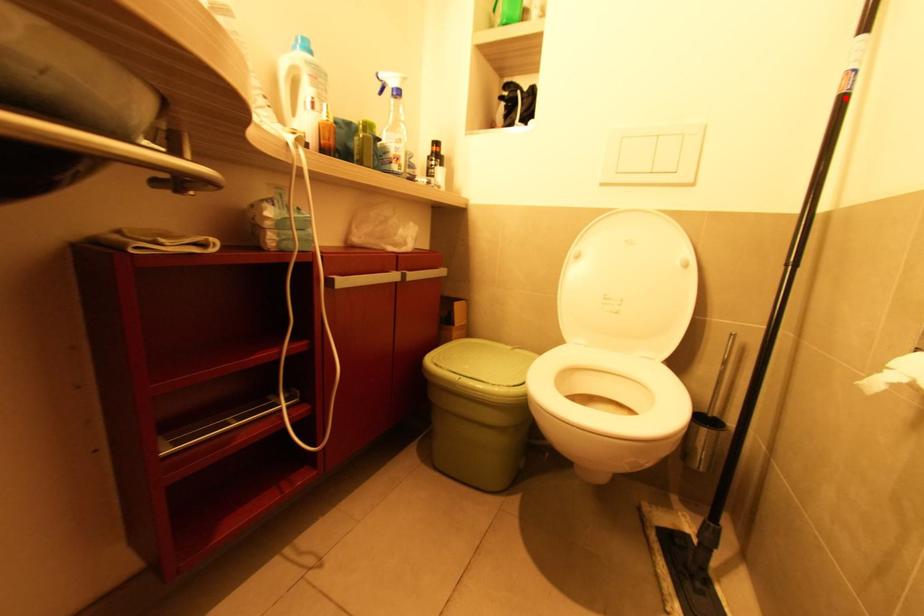
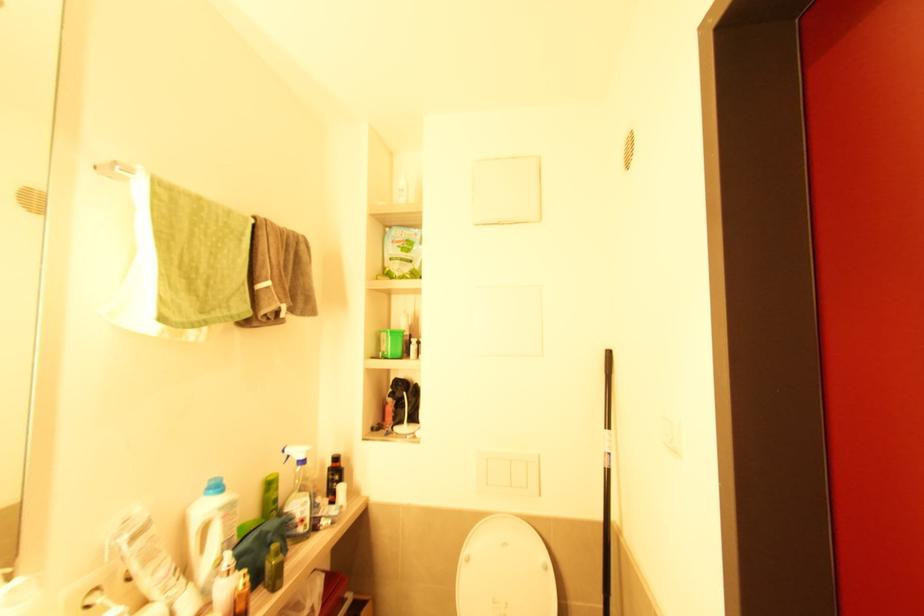
In the second image, find the point that corresponds to the highlighted location in the first image.

(610, 472)